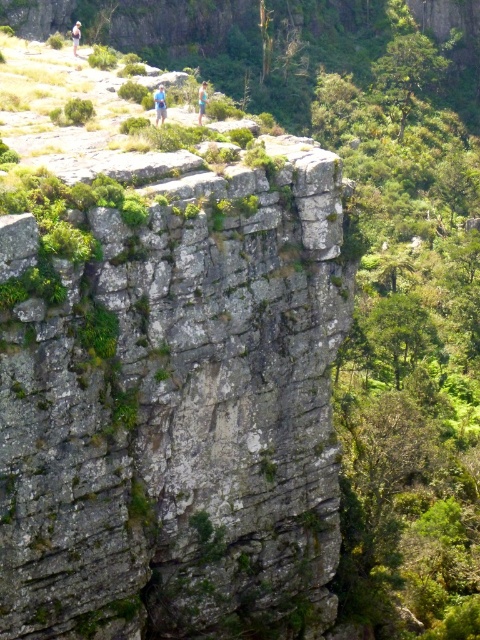
You are a hiker trying to navigate the rugged cliff face. You see a blue fabric person at upper center and a blue fabric shirt at upper center. Which object is positioned lower on the cliff face?

The blue fabric person at upper center is positioned lower on the cliff face than the blue fabric shirt at upper center.

You are a photographer trying to capture a photo of the blue fabric person at upper center and the blue denim shorts at upper left. From your current position, which object is located to the right of the other?

The blue fabric person at upper center is positioned on the right side of blue denim shorts at upper left.